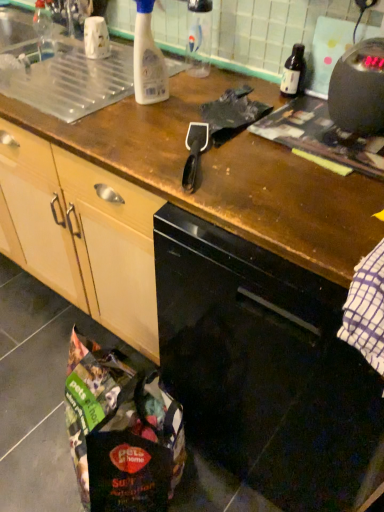
Find the location of a particular element. This screenshot has width=384, height=512. vacant area that lies between transparent plastic bottle at upper center, the 2th bottle from the left, and translucent glass bottle at upper right, acting as the 1th bottle starting from the right is located at coordinates (240, 84).